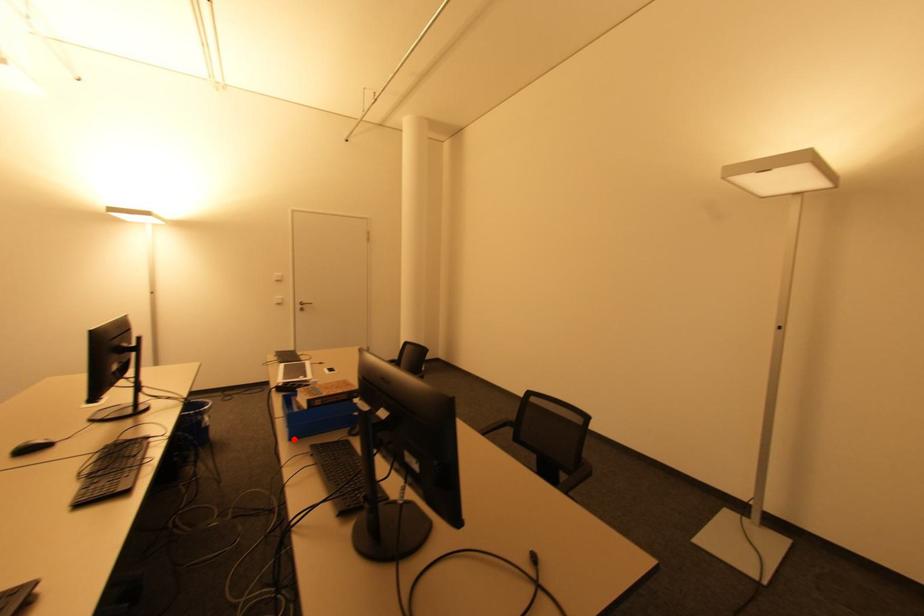
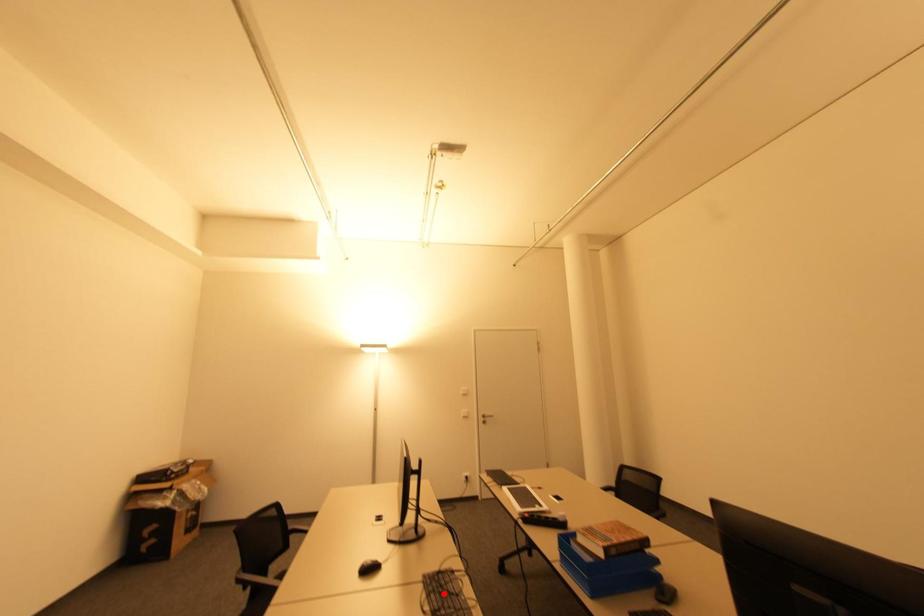
I am providing you with two images of the same scene from different viewpoints. A red point is marked on the first image and another point is marked on the second image. Are the points marked in image1 and image2 representing the same 3D position?

No